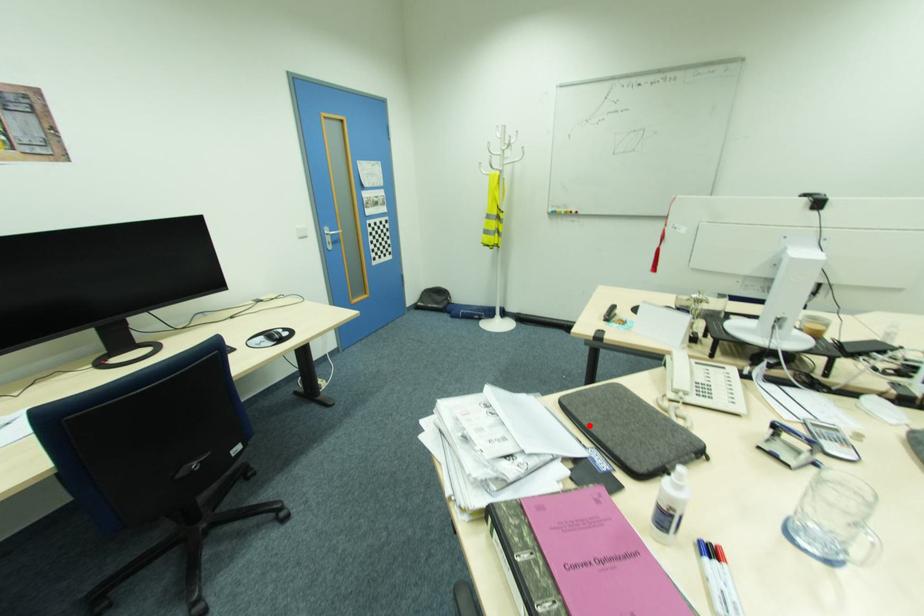
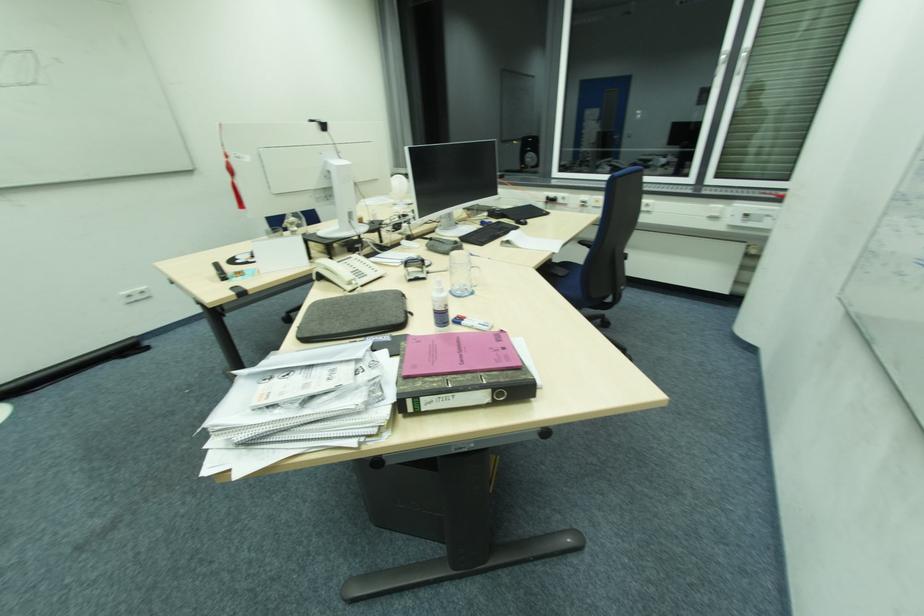
Find the pixel in the second image that matches the highlighted location in the first image.

(348, 331)